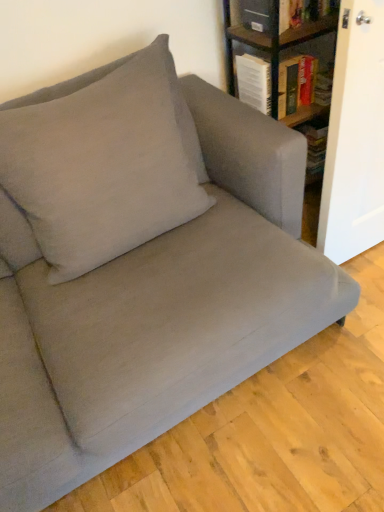
Question: Does wooden bookshelf at upper right have a larger size compared to suede-like beige pillow at upper left?

Choices:
 (A) yes
 (B) no

Answer: (B)

Question: Is wooden bookshelf at upper right taller than suede-like beige pillow at upper left?

Choices:
 (A) yes
 (B) no

Answer: (B)

Question: From the image's perspective, does wooden bookshelf at upper right appear higher than suede-like beige pillow at upper left?

Choices:
 (A) no
 (B) yes

Answer: (B)

Question: Does wooden bookshelf at upper right have a greater width compared to suede-like beige pillow at upper left?

Choices:
 (A) yes
 (B) no

Answer: (A)

Question: Is wooden bookshelf at upper right shorter than suede-like beige pillow at upper left?

Choices:
 (A) no
 (B) yes

Answer: (B)

Question: Considering the positions of hardcover book at upper right and wooden bookshelf at upper right in the image, is hardcover book at upper right bigger or smaller than wooden bookshelf at upper right?

Choices:
 (A) small
 (B) big

Answer: (A)

Question: Is hardcover book at upper right taller or shorter than wooden bookshelf at upper right?

Choices:
 (A) short
 (B) tall

Answer: (A)

Question: From the image's perspective, is hardcover book at upper right above or below wooden bookshelf at upper right?

Choices:
 (A) below
 (B) above

Answer: (A)

Question: Considering their positions, is hardcover book at upper right located in front of or behind wooden bookshelf at upper right?

Choices:
 (A) front
 (B) behind

Answer: (B)

Question: Is wooden bookshelf at upper right taller or shorter than hardcover book at upper right?

Choices:
 (A) tall
 (B) short

Answer: (A)

Question: Looking at the image, does wooden bookshelf at upper right seem bigger or smaller compared to hardcover book at upper right?

Choices:
 (A) big
 (B) small

Answer: (A)

Question: From a real-world perspective, is wooden bookshelf at upper right above or below hardcover book at upper right?

Choices:
 (A) below
 (B) above

Answer: (B)

Question: Is point (228, 5) positioned closer to the camera than point (279, 96)?

Choices:
 (A) farther
 (B) closer

Answer: (B)

Question: Based on their sizes in the image, would you say hardcover book at upper right is bigger or smaller than suede-like beige pillow at upper left?

Choices:
 (A) big
 (B) small

Answer: (B)

Question: Choose the correct answer: Is hardcover book at upper right inside suede-like beige pillow at upper left or outside it?

Choices:
 (A) inside
 (B) outside

Answer: (B)